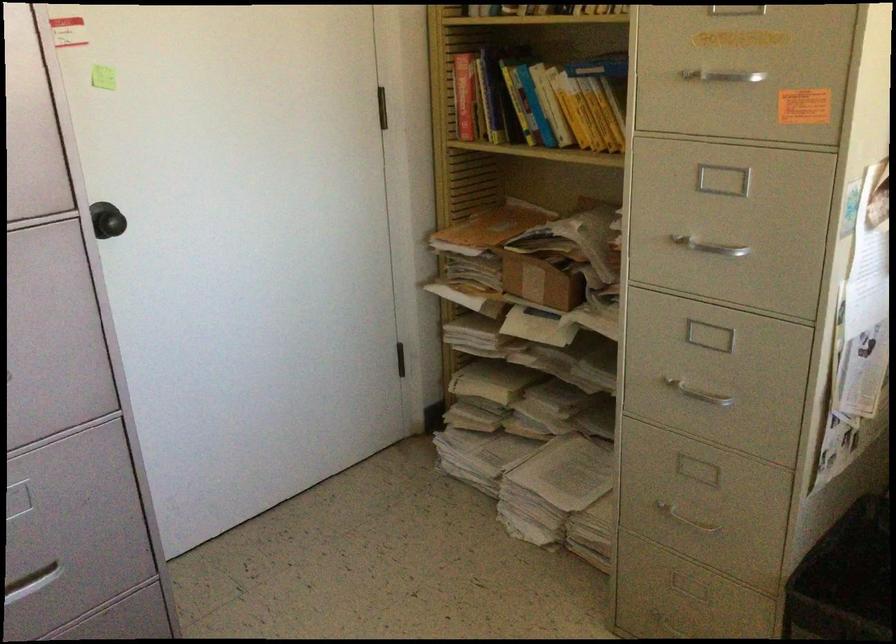
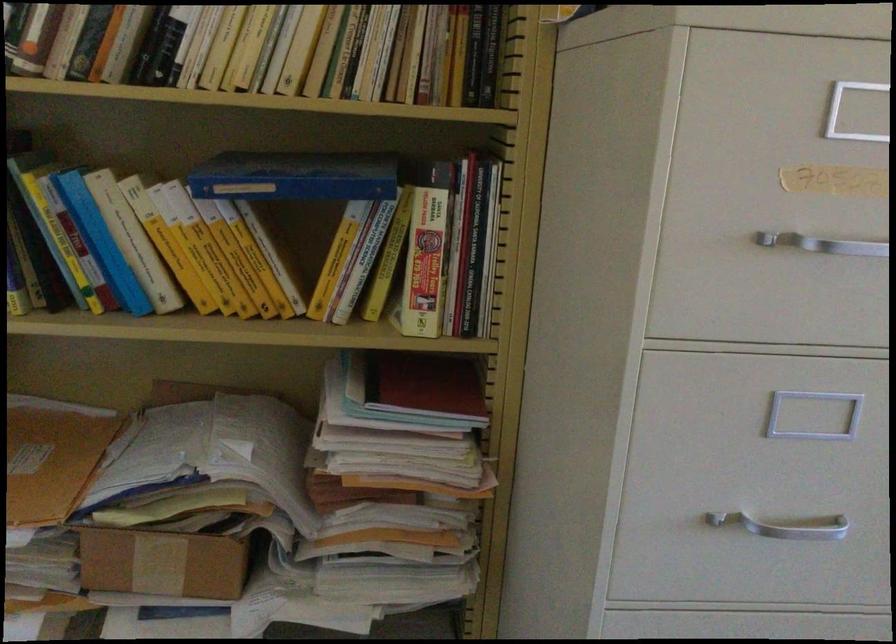
Locate, in the second image, the point that corresponds to (x=527, y=279) in the first image.

(161, 564)